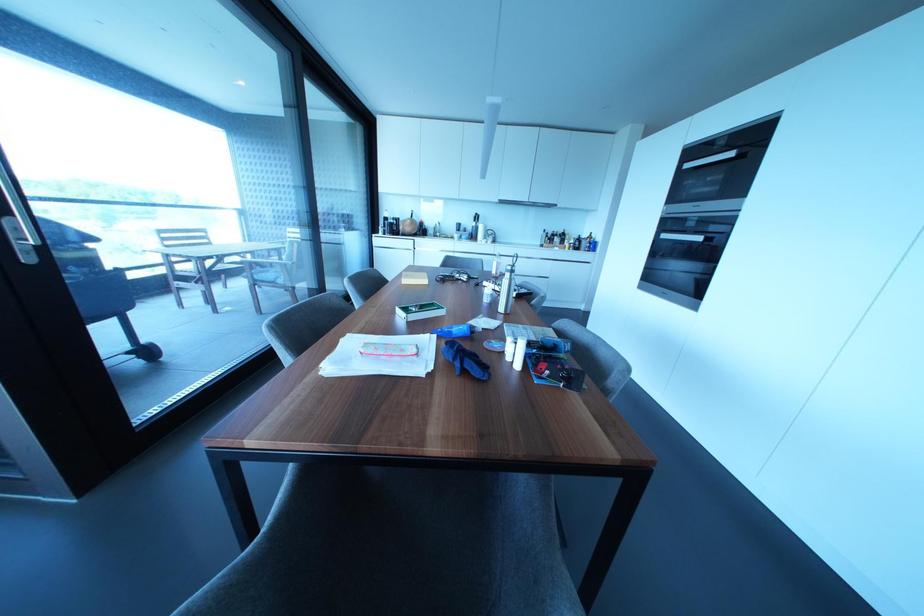
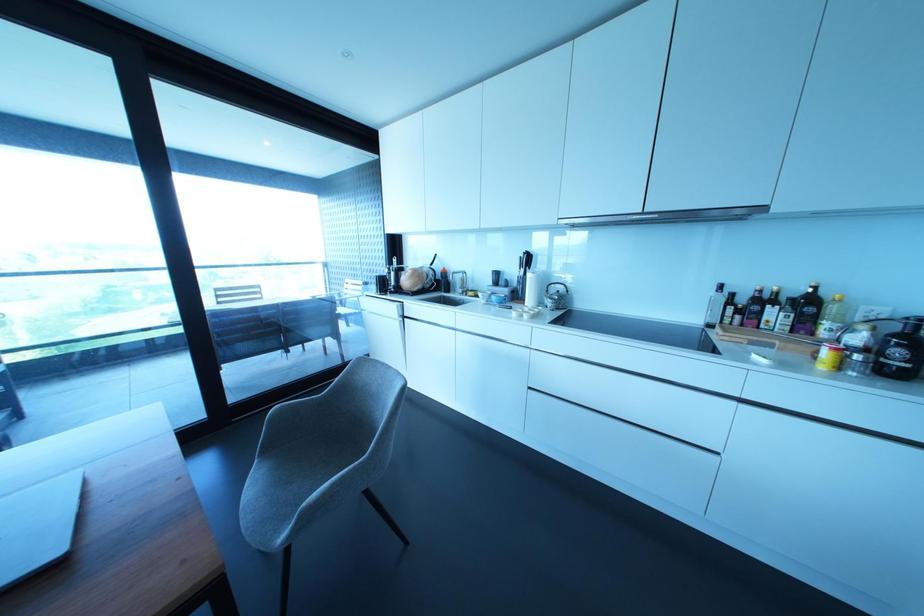
Locate, in the second image, the point that corresponds to [476,217] in the first image.

(527, 259)